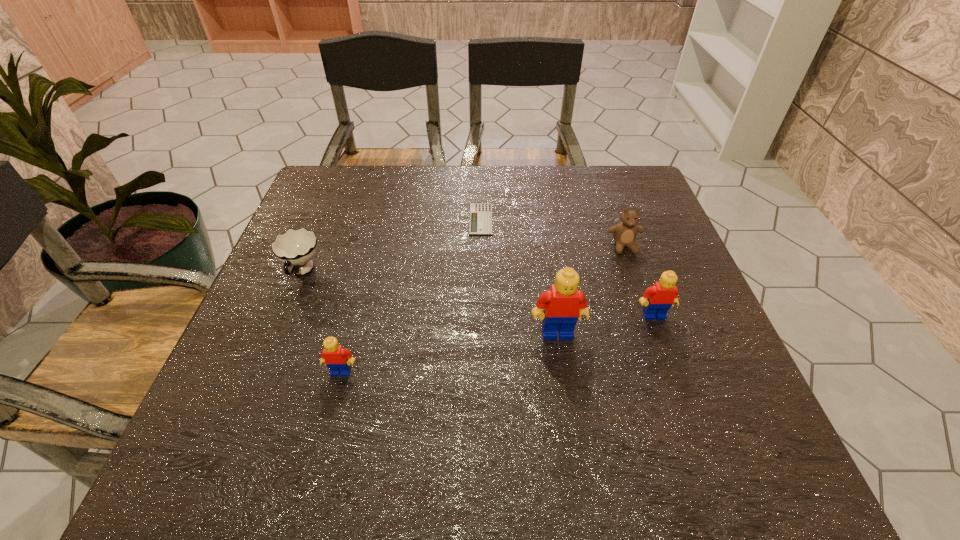
This screenshot has width=960, height=540. Find the location of `free spot between the fifth shortest object and the leftmost Lego`. free spot between the fifth shortest object and the leftmost Lego is located at coordinates (497, 343).

Locate an element on the screen. free space between the teddy bear and the rightmost Lego is located at coordinates (638, 281).

You are a GUI agent. You are given a task and a screenshot of the screen. Output one action in this format:
    pyautogui.click(x=<x>, y=<y>)
    Task: Click on the unoccupied area between the leftmost Lego and the second tallest object
    The width and height of the screenshot is (960, 540).
    Given the screenshot: What is the action you would take?
    pyautogui.click(x=497, y=343)

You are a GUI agent. You are given a task and a screenshot of the screen. Output one action in this format:
    pyautogui.click(x=<x>, y=<y>)
    Task: Click on the free spot between the fifth tallest object and the tallest object
    
    Given the screenshot: What is the action you would take?
    pyautogui.click(x=430, y=302)

Where is `vacant space in between the nearest object and the second shortest object`? vacant space in between the nearest object and the second shortest object is located at coordinates (322, 322).

Find the location of a particular element. The width and height of the screenshot is (960, 540). free area in between the shortest object and the teddy bear is located at coordinates (552, 233).

You are a GUI agent. You are given a task and a screenshot of the screen. Output one action in this format:
    pyautogui.click(x=<x>, y=<y>)
    Task: Click on the free spot between the second object from left to right and the teddy bear
    The height and width of the screenshot is (540, 960).
    Given the screenshot: What is the action you would take?
    pyautogui.click(x=483, y=309)

Identify the location of vacant space that's between the fifth object from right to left and the fifth shortest object. This screenshot has height=540, width=960. (497, 343).

Select which object is the third closest to the fifth farthest object. Please provide its 2D coordinates. Your answer should be formatted as a tuple, i.e. [(x, y)], where the tuple contains the x and y coordinates of a point satisfying the conditions above.

[(480, 220)]

Locate an element on the screen. the fifth closest object to the shortest Lego is located at coordinates (624, 233).